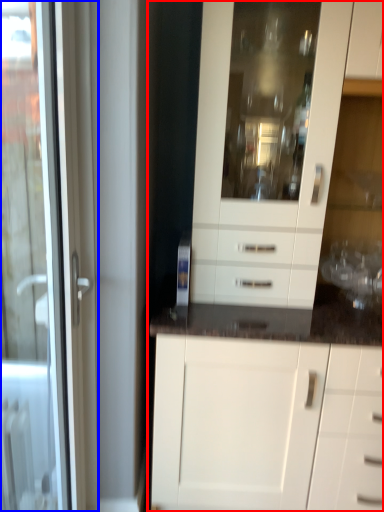
Question: Which object appears closest to the camera in this image, cabinetry (highlighted by a red box) or door (highlighted by a blue box)?

Choices:
 (A) cabinetry
 (B) door

Answer: (B)